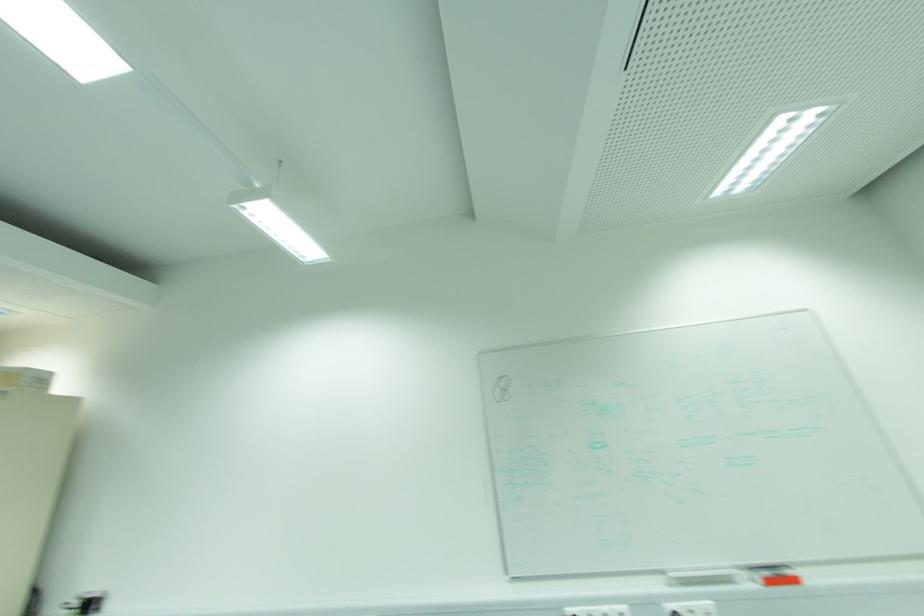
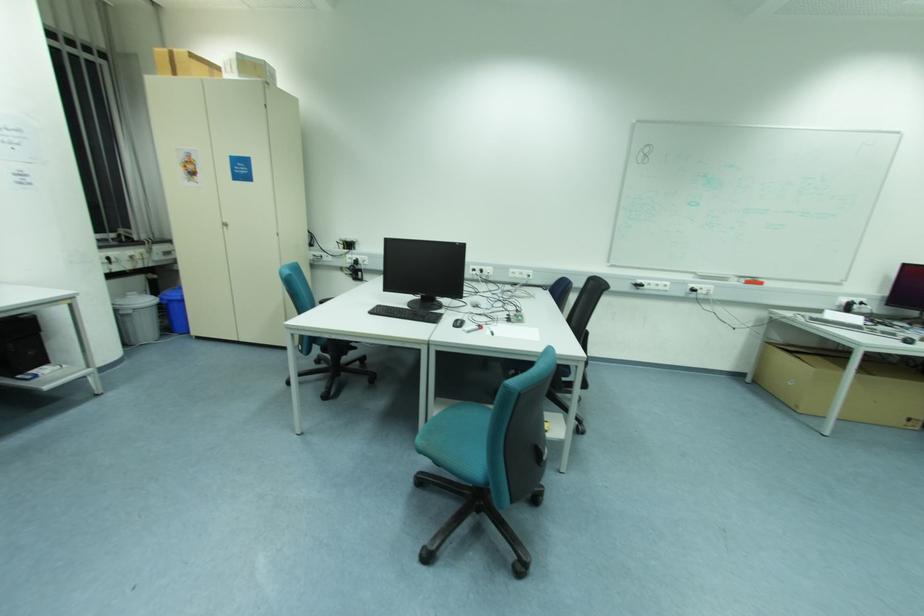
In the second image, find the point that corresponds to (x=796, y=581) in the first image.

(761, 284)